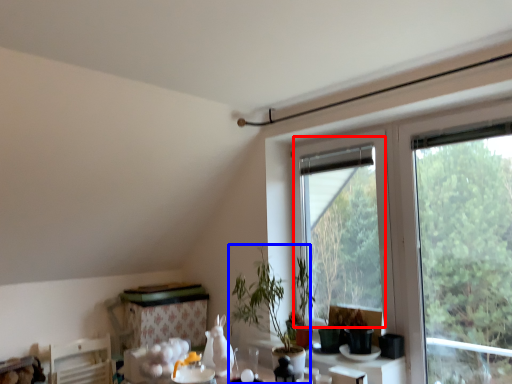
Question: Which object is closer to the camera taking this photo, bay window (highlighted by a red box) or houseplant (highlighted by a blue box)?

Choices:
 (A) bay window
 (B) houseplant

Answer: (B)